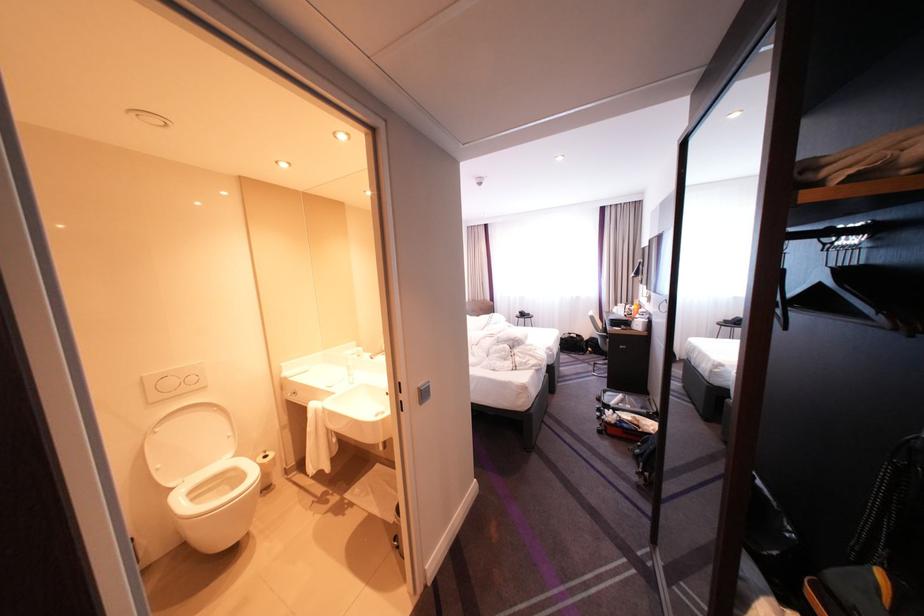
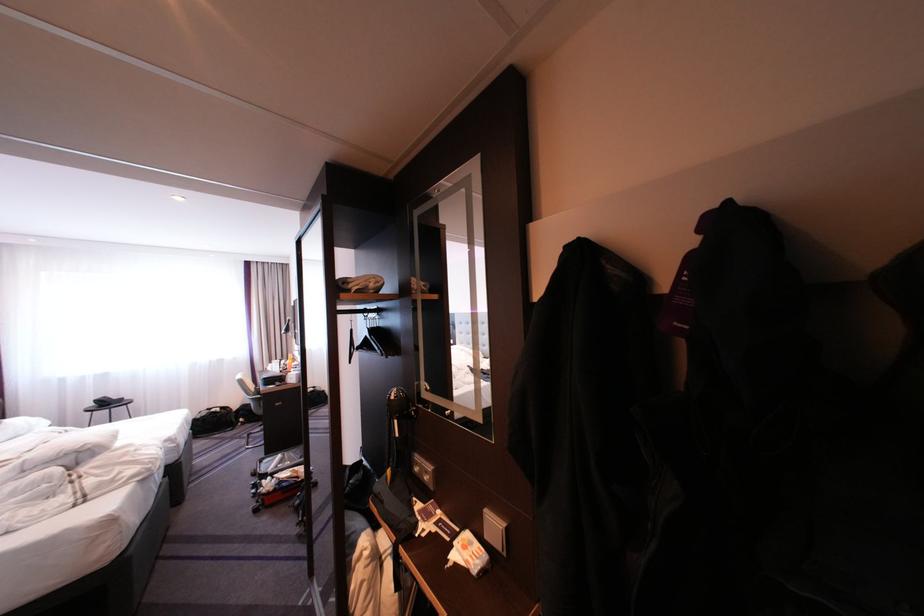
In the second image, find the point that corresponds to the point at 610,331 in the first image.

(261, 395)